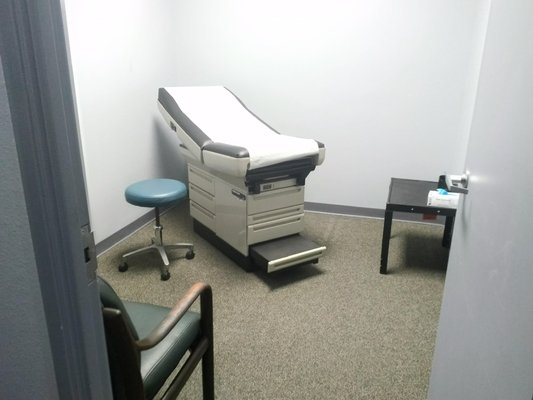
This screenshot has width=533, height=400. I want to click on light blue seat, so click(x=155, y=189).